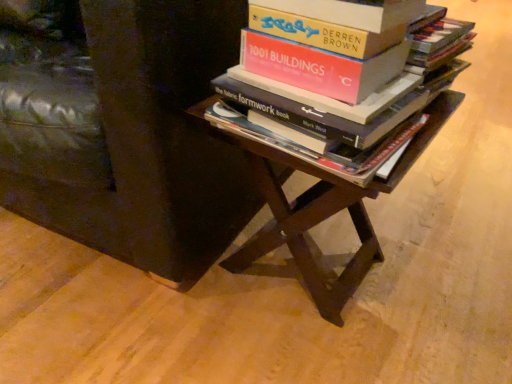
The height and width of the screenshot is (384, 512). Find the location of `hardcover book at center`. hardcover book at center is located at coordinates (339, 100).

Does point (308, 246) come behind point (272, 53)?

That is True.

Considering the sizes of objects brown wooden table at center and hardcover book at center in the image provided, who is taller, brown wooden table at center or hardcover book at center?

With more height is brown wooden table at center.

From a real-world perspective, is brown wooden table at center physically located above or below hardcover book at center?

brown wooden table at center is situated lower than hardcover book at center in the real world.

Does brown wooden table at center have a greater width compared to wooden side table at center?

No.

Considering the relative sizes of brown wooden table at center and wooden side table at center in the image provided, is brown wooden table at center shorter than wooden side table at center?

Yes, brown wooden table at center is shorter than wooden side table at center.

Looking at this image, considering the relative positions of brown wooden table at center and wooden side table at center in the image provided, is brown wooden table at center to the left of wooden side table at center from the viewer's perspective?

No, brown wooden table at center is not to the left of wooden side table at center.

From the image's perspective, is brown wooden table at center above wooden side table at center?

Actually, brown wooden table at center appears below wooden side table at center in the image.

Is wooden side table at center located outside brown wooden table at center?

Yes, wooden side table at center is outside of brown wooden table at center.

Considering the sizes of objects wooden side table at center and brown wooden table at center in the image provided, who is shorter, wooden side table at center or brown wooden table at center?

brown wooden table at center is shorter.

Is wooden side table at center aimed at brown wooden table at center?

No, wooden side table at center is not facing towards brown wooden table at center.

Is wooden side table at center to the left or to the right of brown wooden table at center in the image?

Based on their positions, wooden side table at center is located to the left of brown wooden table at center.

Can you confirm if hardcover book at center is wider than brown wooden table at center?

No, hardcover book at center is not wider than brown wooden table at center.

Identify the location of table below the hardcover book at center (from a real-world perspective). The height and width of the screenshot is (384, 512). (318, 207).

Is brown wooden table at center at the back of hardcover book at center?

No.

Choose the correct answer: Is wooden side table at center inside hardcover book at center or outside it?

wooden side table at center is outside hardcover book at center.

Which object is further away from the camera taking this photo, wooden side table at center or hardcover book at center?

wooden side table at center.

There is a wooden side table at center. At what (x,y) coordinates should I click in order to perform the action: click on book above it (from a real-world perspective). Please return your answer as a coordinate pair (x, y). The width and height of the screenshot is (512, 384). Looking at the image, I should click on (339, 100).

Which is behind, point (252, 200) or point (418, 104)?

Positioned behind is point (252, 200).

Is there a large distance between hardcover book at center and wooden side table at center?

They are positioned close to each other.

Is point (291, 103) closer or farther from the camera than point (10, 144)?

Point (291, 103) is positioned closer to the camera compared to point (10, 144).

In the scene shown: From the image's perspective, is hardcover book at center located above or below wooden side table at center?

hardcover book at center is situated lower than wooden side table at center in the image.

Is hardcover book at center inside or outside of wooden side table at center?

hardcover book at center is located beyond the bounds of wooden side table at center.

This screenshot has height=384, width=512. In the image, there is a hardcover book at center. Identify the location of table below it (from a real-world perspective). (318, 207).

The width and height of the screenshot is (512, 384). Find the location of `table below the wooden side table at center (from the image's perspective)`. table below the wooden side table at center (from the image's perspective) is located at coordinates (318, 207).

From the image, which object appears to be nearer to wooden side table at center, brown wooden table at center or hardcover book at center?

The object closer to wooden side table at center is brown wooden table at center.

Consider the image. Which object lies nearer to the anchor point hardcover book at center, brown wooden table at center or wooden side table at center?

brown wooden table at center.

Based on their spatial positions, is wooden side table at center or hardcover book at center further from brown wooden table at center?

Among the two, wooden side table at center is located further to brown wooden table at center.

Based on their spatial positions, is hardcover book at center or brown wooden table at center closer to wooden side table at center?

Based on the image, brown wooden table at center appears to be nearer to wooden side table at center.

Looking at the image, which one is located closer to brown wooden table at center, hardcover book at center or wooden side table at center?

hardcover book at center is closer to brown wooden table at center.

Based on their spatial positions, is wooden side table at center or brown wooden table at center closer to hardcover book at center?

Based on the image, brown wooden table at center appears to be nearer to hardcover book at center.

You are a GUI agent. You are given a task and a screenshot of the screen. Output one action in this format:
    pyautogui.click(x=<x>, y=<y>)
    Task: Click on the book located between wooden side table at center and brown wooden table at center in the left-right direction
    
    Given the screenshot: What is the action you would take?
    pyautogui.click(x=339, y=100)